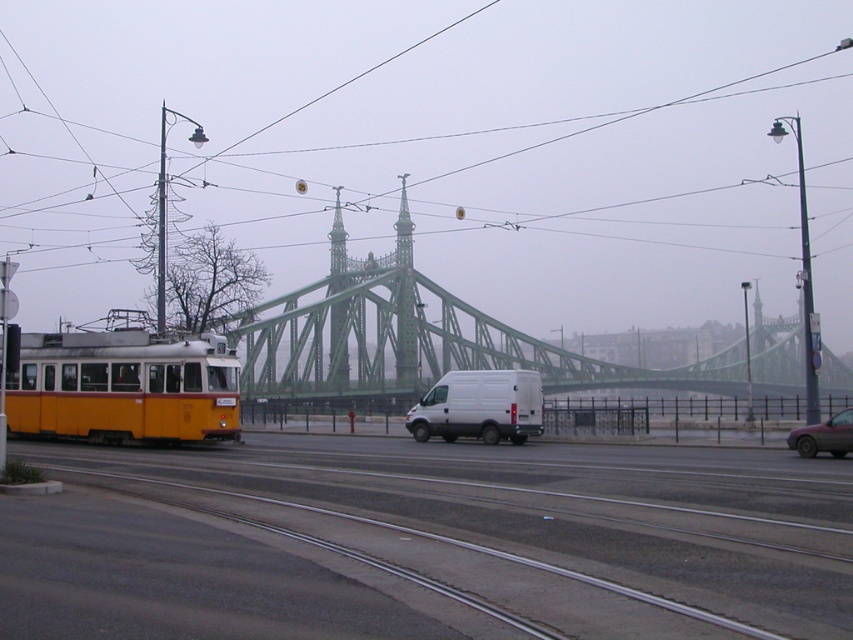
Question: Does metallic gray tracks at center come behind metallic red car at lower right?

Choices:
 (A) yes
 (B) no

Answer: (B)

Question: Which point is closer to the camera?

Choices:
 (A) (840, 440)
 (B) (445, 420)
 (C) (303, 480)
 (D) (401, 298)

Answer: (C)

Question: Can you confirm if metallic gray tracks at center is thinner than green metal bridge at center?

Choices:
 (A) no
 (B) yes

Answer: (B)

Question: Does metallic gray tracks at center have a greater width compared to white matte van at center?

Choices:
 (A) yes
 (B) no

Answer: (A)

Question: Among these objects, which one is farthest from the camera?

Choices:
 (A) metallic gray tracks at center
 (B) green metal bridge at center

Answer: (B)

Question: Which object appears closest to the camera in this image?

Choices:
 (A) green metal bridge at center
 (B) metallic red car at lower right
 (C) white matte van at center

Answer: (B)